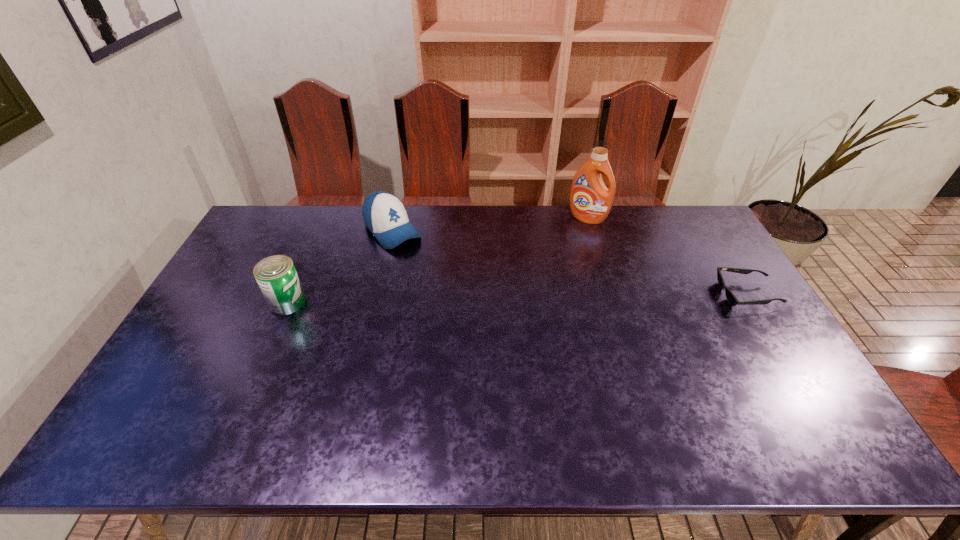
I want to click on vacant space at the near edge of the desktop, so click(x=228, y=407).

Find the location of a particular element. vacant space at the left edge of the desktop is located at coordinates (208, 338).

In the image, there is a desktop. Where is `vacant space at the right edge`? The image size is (960, 540). vacant space at the right edge is located at coordinates point(771,358).

In the image, there is a desktop. Where is `vacant space at the far right corner`? vacant space at the far right corner is located at coordinates (698, 218).

You are a GUI agent. You are given a task and a screenshot of the screen. Output one action in this format:
    pyautogui.click(x=<x>, y=<y>)
    Task: Click on the free location at the near right corner of the desktop
    The width and height of the screenshot is (960, 540).
    Given the screenshot: What is the action you would take?
    pyautogui.click(x=774, y=394)

The height and width of the screenshot is (540, 960). Find the location of `free spot between the detergent and the shortest object`. free spot between the detergent and the shortest object is located at coordinates (667, 256).

Where is `vacant space that is in between the tallest object and the rightmost object`? This screenshot has width=960, height=540. vacant space that is in between the tallest object and the rightmost object is located at coordinates (667, 256).

The image size is (960, 540). Find the location of `free space between the baseball cap and the rightmost object`. free space between the baseball cap and the rightmost object is located at coordinates (569, 262).

Locate an element on the screen. Image resolution: width=960 pixels, height=540 pixels. vacant space that is in between the detergent and the shortest object is located at coordinates coord(667,256).

In order to click on free spot between the can and the sunglasses in this screenshot , I will do `click(516, 298)`.